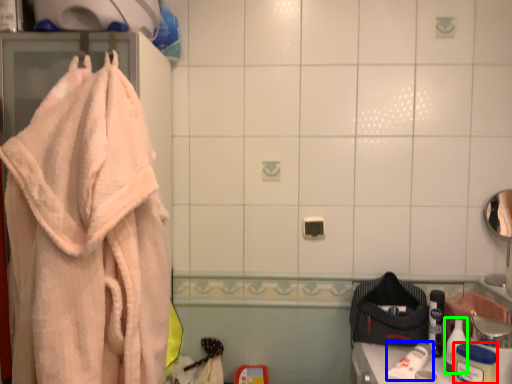
Question: Considering the real-world distances, which object is closest to toiletry (highlighted by a red box)? toilet paper (highlighted by a blue box) or toiletry (highlighted by a green box).

Choices:
 (A) toilet paper
 (B) toiletry

Answer: (B)